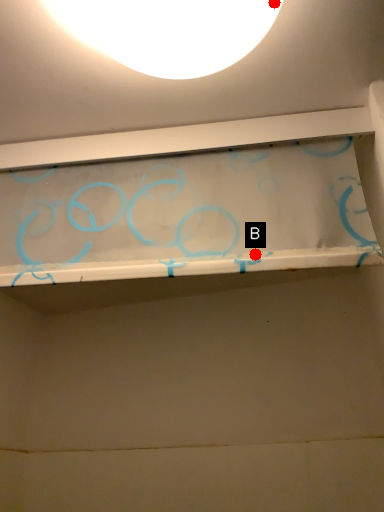
Question: Two points are circled on the image, labeled by A and B beside each circle. Which point appears closest to the camera in this image?

Choices:
 (A) A is closer
 (B) B is closer

Answer: (A)